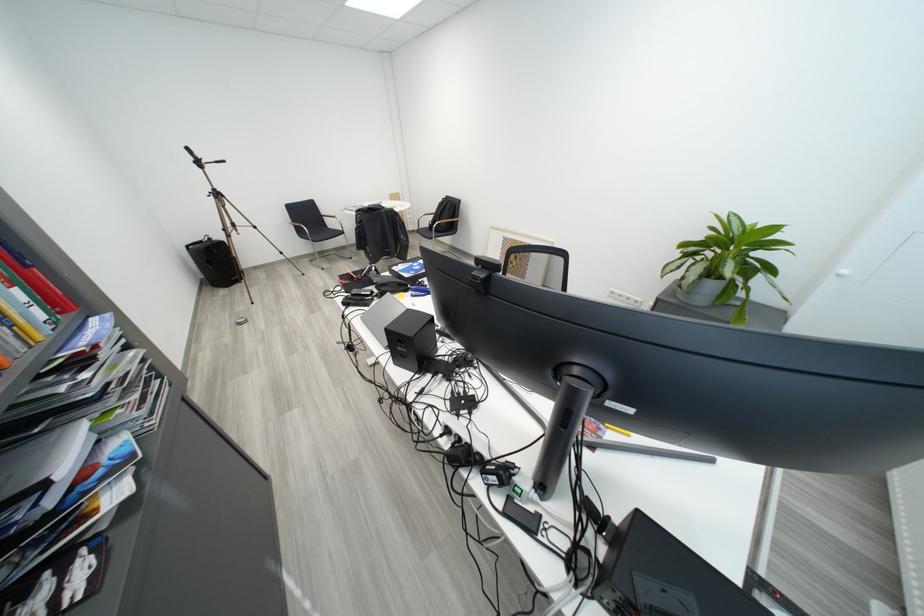
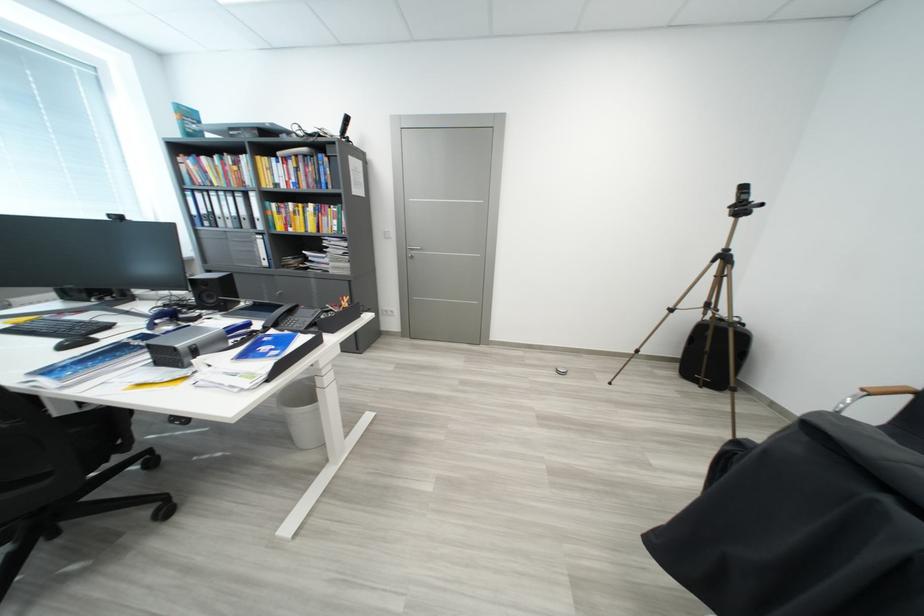
Where in the second image is the point corresponding to pixel 232 293 from the first image?

(684, 377)